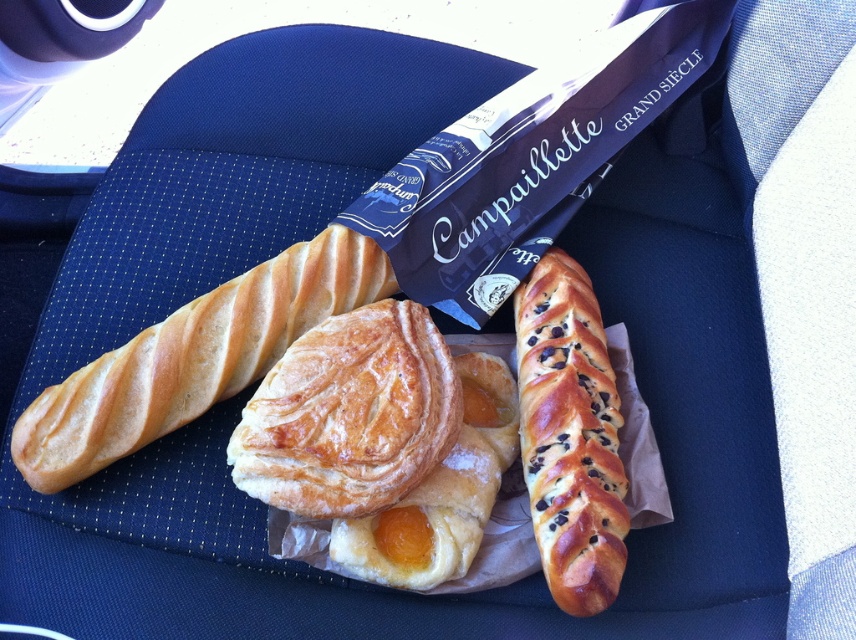
Between golden-brown braided bread at center-right and golden flaky pastry at center, which one is positioned higher?

golden-brown braided bread at center-right

Between golden-brown braided bread at center-right and golden flaky pastry at center, which one has more height?

Standing taller between the two is golden-brown braided bread at center-right.

Does point (596, 444) come farther from viewer compared to point (498, 364)?

No, (596, 444) is in front of (498, 364).

Locate an element on the screen. Image resolution: width=856 pixels, height=640 pixels. golden-brown braided bread at center-right is located at coordinates (569, 435).

From the picture: Measure the distance between golden-brown flaky pastry at center and camera.

golden-brown flaky pastry at center is 1.16 meters from camera.

Does golden-brown flaky pastry at center have a lesser height compared to golden-brown braided bread at center-right?

Yes.

You are a GUI agent. You are given a task and a screenshot of the screen. Output one action in this format:
    pyautogui.click(x=<x>, y=<y>)
    Task: Click on the golden-brown flaky pastry at center
    Image resolution: width=856 pixels, height=640 pixels.
    Given the screenshot: What is the action you would take?
    pyautogui.click(x=193, y=356)

From the picture: Can you confirm if golden brown flaky pastry at center is positioned to the right of golden flaky pastry at center?

No, golden brown flaky pastry at center is not to the right of golden flaky pastry at center.

Is golden brown flaky pastry at center above golden flaky pastry at center?

Yes.

Find the location of a particular element. The height and width of the screenshot is (640, 856). golden brown flaky pastry at center is located at coordinates (349, 413).